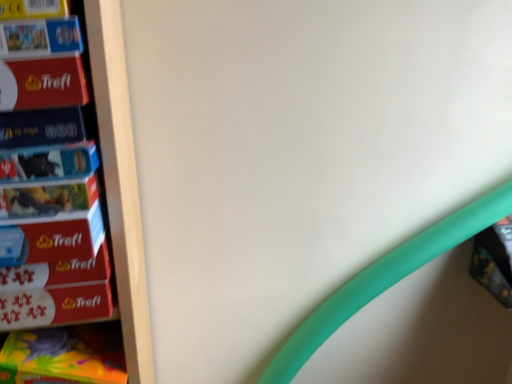
Question: Is matte plastic book at right, which is the 1th book in bottom-to-top order, bigger than matte cardboard book at left, the second paperback book in the bottom-to-top sequence?

Choices:
 (A) yes
 (B) no

Answer: (A)

Question: Does matte plastic book at right, which is the 1th book in bottom-to-top order, have a smaller size compared to matte cardboard book at left, the second paperback book in the bottom-to-top sequence?

Choices:
 (A) yes
 (B) no

Answer: (B)

Question: Is matte plastic book at right, which is the 1th book in bottom-to-top order, to the right of matte cardboard book at left, the second paperback book positioned from the top, from the viewer's perspective?

Choices:
 (A) yes
 (B) no

Answer: (A)

Question: Is matte plastic book at right, the first book viewed from the back, placed right next to matte cardboard book at left, the second paperback book in the bottom-to-top sequence?

Choices:
 (A) yes
 (B) no

Answer: (B)

Question: Is matte plastic book at right, which is the 1th book in bottom-to-top order, taller than matte cardboard book at left, the second paperback book in the bottom-to-top sequence?

Choices:
 (A) yes
 (B) no

Answer: (A)

Question: From the image's perspective, is matte plastic book at right, which is the second book in left-to-right order, located above matte cardboard book at left, the second paperback book in the bottom-to-top sequence?

Choices:
 (A) yes
 (B) no

Answer: (B)

Question: Can you confirm if matte black book at left, which is the 1th paperback book in bottom-to-top order, is wider than matte plastic book at right, the 1th book viewed from the right?

Choices:
 (A) yes
 (B) no

Answer: (A)

Question: Could you tell me if matte black book at left, placed as the third paperback book when sorted from top to bottom, is facing matte plastic book at right, which is the 1th book in bottom-to-top order?

Choices:
 (A) no
 (B) yes

Answer: (A)

Question: Does matte black book at left, placed as the third paperback book when sorted from top to bottom, come in front of matte plastic book at right, which is the 1th book in bottom-to-top order?

Choices:
 (A) yes
 (B) no

Answer: (A)

Question: From the image's perspective, is matte black book at left, placed as the third paperback book when sorted from top to bottom, under matte plastic book at right, the second book in the front-to-back sequence?

Choices:
 (A) no
 (B) yes

Answer: (A)

Question: Is matte black book at left, placed as the third paperback book when sorted from top to bottom, not within matte plastic book at right, the 1th book viewed from the right?

Choices:
 (A) no
 (B) yes

Answer: (B)

Question: Does matte black book at left, placed as the third paperback book when sorted from top to bottom, have a larger size compared to matte plastic book at right, which is the second book in left-to-right order?

Choices:
 (A) yes
 (B) no

Answer: (B)

Question: From the image's perspective, does matte black book at left, placed as the third paperback book when sorted from top to bottom, appear lower than matte red puzzle box at left, the 1th paperback book from the top?

Choices:
 (A) no
 (B) yes

Answer: (B)